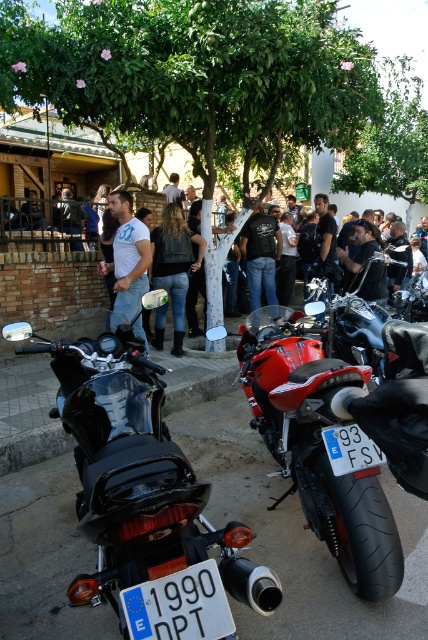
Can you confirm if black matte motorcycle at center is wider than black leather jacket at center?

Yes, black matte motorcycle at center is wider than black leather jacket at center.

Does black matte motorcycle at center lie in front of black leather jacket at center?

That is True.

Does point (189, 476) come closer to viewer compared to point (241, 228)?

Yes.

In order to click on black matte motorcycle at center in this screenshot , I will do `click(143, 497)`.

Does black matte motorcycle at center appear on the left side of white t-shirt at center?

No, black matte motorcycle at center is not to the left of white t-shirt at center.

Is black matte motorcycle at center wider than white t-shirt at center?

Indeed, black matte motorcycle at center has a greater width compared to white t-shirt at center.

Image resolution: width=428 pixels, height=640 pixels. What do you see at coordinates (143, 497) in the screenshot?
I see `black matte motorcycle at center` at bounding box center [143, 497].

This screenshot has width=428, height=640. I want to click on black matte motorcycle at center, so click(x=143, y=497).

Is leather jacket at center thinner than black leather jacket at center?

No.

Can you confirm if leather jacket at center is wider than black leather jacket at center?

Yes.

The width and height of the screenshot is (428, 640). Describe the element at coordinates (175, 262) in the screenshot. I see `leather jacket at center` at that location.

You are a GUI agent. You are given a task and a screenshot of the screen. Output one action in this format:
    pyautogui.click(x=<x>, y=<y>)
    Task: Click on the leather jacket at center
    The height and width of the screenshot is (640, 428).
    Given the screenshot: What is the action you would take?
    (x=175, y=262)